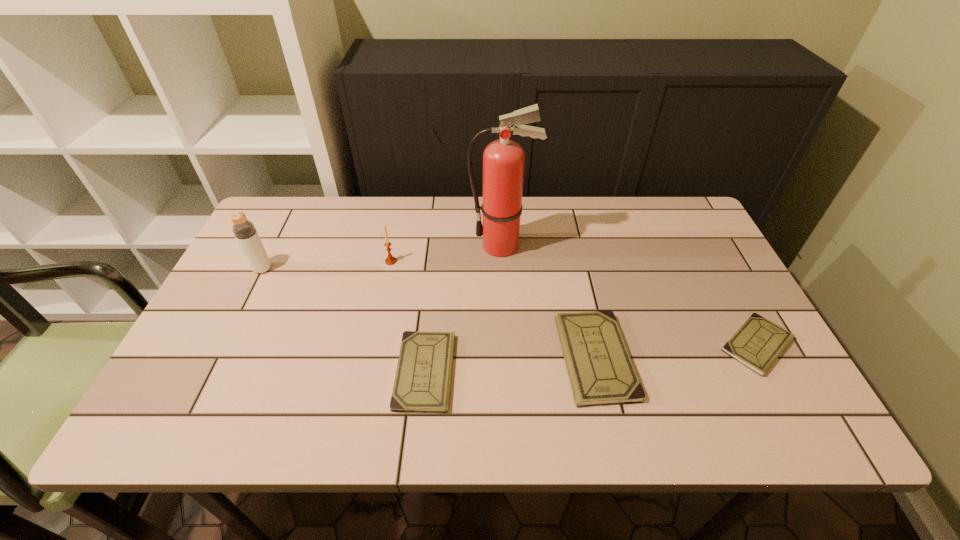
Considering the uniform spacing of checkbooks, where should an additional checkbook be positioned on the left? Please locate a free spot. Please provide its 2D coordinates. Your answer should be formatted as a tuple, i.e. [(x, y)], where the tuple contains the x and y coordinates of a point satisfying the conditions above.

[(245, 386)]